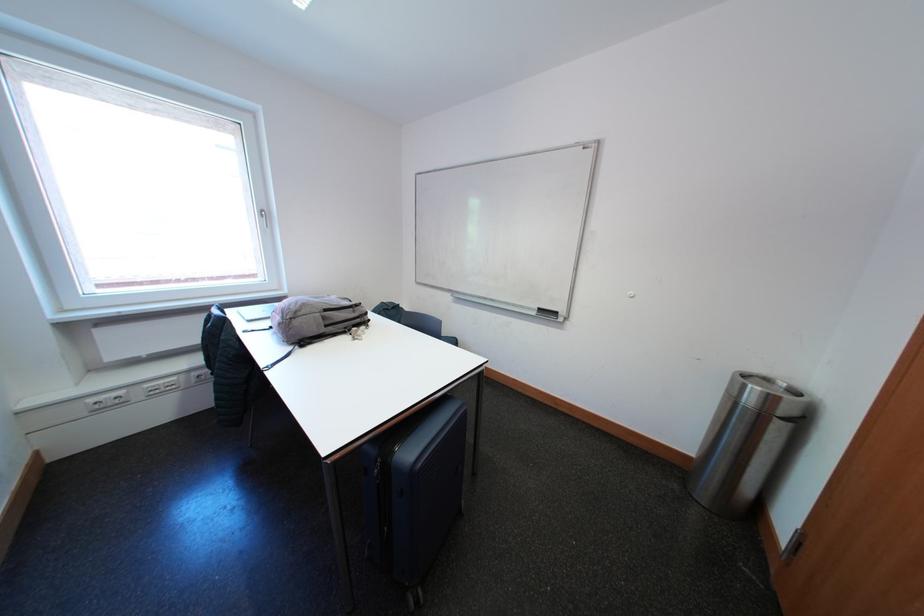
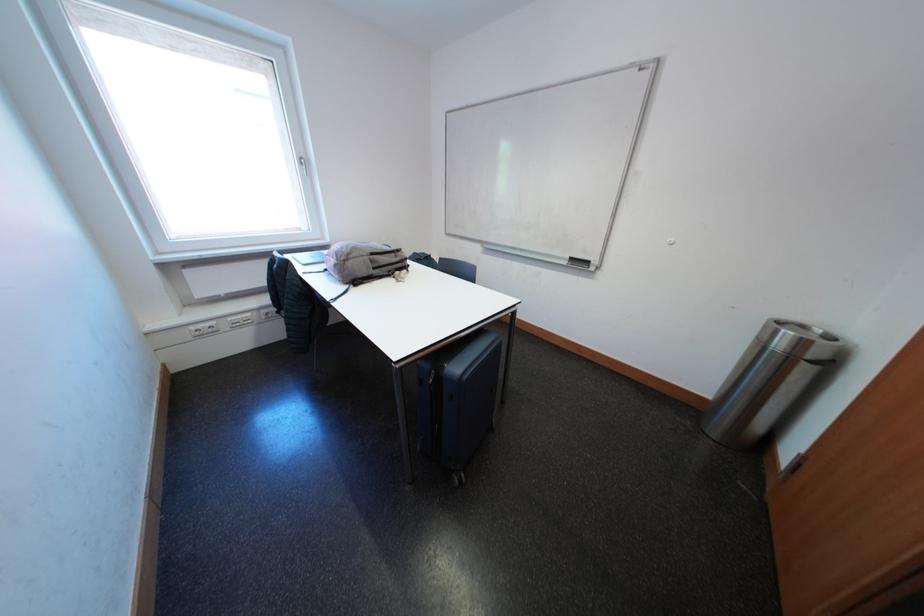
Locate, in the second image, the point that corresponds to the point at 791,416 in the first image.

(821, 360)